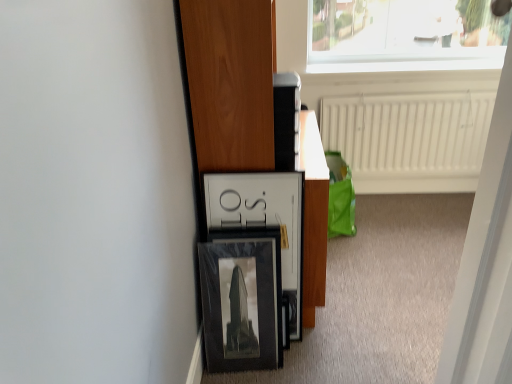
Question: Can you confirm if matte black frame at center is positioned to the left of white plastic screen door at upper right?

Choices:
 (A) no
 (B) yes

Answer: (B)

Question: Considering the relative sizes of matte black frame at center and white plastic screen door at upper right in the image provided, is matte black frame at center wider than white plastic screen door at upper right?

Choices:
 (A) yes
 (B) no

Answer: (A)

Question: Is matte black frame at center bigger than white plastic screen door at upper right?

Choices:
 (A) no
 (B) yes

Answer: (B)

Question: Is matte black frame at center further to camera compared to white plastic screen door at upper right?

Choices:
 (A) no
 (B) yes

Answer: (B)

Question: Is matte black frame at center taller than white plastic screen door at upper right?

Choices:
 (A) no
 (B) yes

Answer: (B)

Question: Does matte black frame at center turn towards white plastic screen door at upper right?

Choices:
 (A) no
 (B) yes

Answer: (A)

Question: Is white plastic screen door at upper right not inside matte black frame at center?

Choices:
 (A) no
 (B) yes

Answer: (B)

Question: From the image's perspective, is white plastic screen door at upper right beneath matte black frame at center?

Choices:
 (A) no
 (B) yes

Answer: (B)

Question: Does white plastic screen door at upper right have a greater height compared to matte black frame at center?

Choices:
 (A) no
 (B) yes

Answer: (A)

Question: Does white plastic screen door at upper right appear on the left side of matte black frame at center?

Choices:
 (A) yes
 (B) no

Answer: (B)

Question: Can you confirm if white plastic screen door at upper right is wider than matte black frame at center?

Choices:
 (A) no
 (B) yes

Answer: (A)

Question: From the image's perspective, is white plastic screen door at upper right on top of matte black frame at center?

Choices:
 (A) no
 (B) yes

Answer: (A)

Question: Considering the relative sizes of white plastic screen door at upper right and white textured radiator at upper center in the image provided, is white plastic screen door at upper right bigger than white textured radiator at upper center?

Choices:
 (A) yes
 (B) no

Answer: (B)